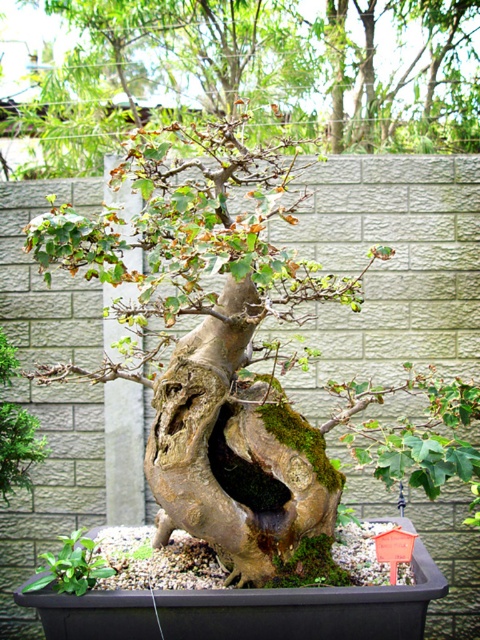
Question: Which point appears closest to the camera in this image?

Choices:
 (A) (374, 97)
 (B) (84, 582)

Answer: (B)

Question: Which point is closer to the camera?

Choices:
 (A) green mossy rock at lower left
 (B) green mossy tree trunk at center

Answer: (A)

Question: Is the position of green mossy tree trunk at center more distant than that of green mossy rock at lower left?

Choices:
 (A) yes
 (B) no

Answer: (A)

Question: Among these points, which one is nearest to the camera?

Choices:
 (A) (316, 72)
 (B) (71, 589)

Answer: (B)

Question: Is green mossy tree trunk at center smaller than green mossy rock at lower left?

Choices:
 (A) no
 (B) yes

Answer: (A)

Question: In this image, where is green mossy tree trunk at center located relative to green mossy rock at lower left?

Choices:
 (A) left
 (B) right

Answer: (B)